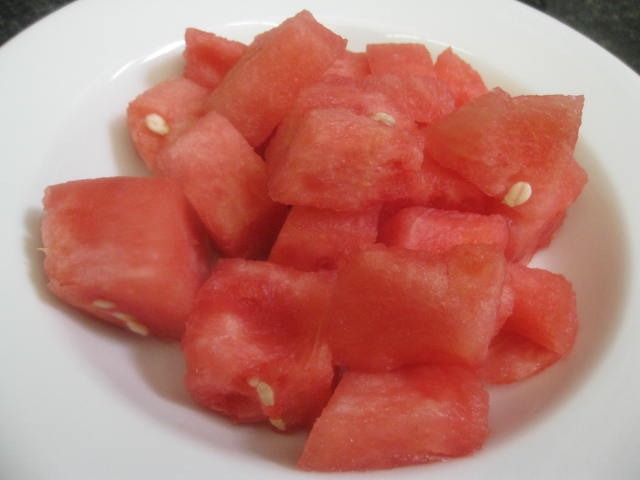
Image resolution: width=640 pixels, height=480 pixels. I want to click on basin of bowl, so click(x=553, y=260).